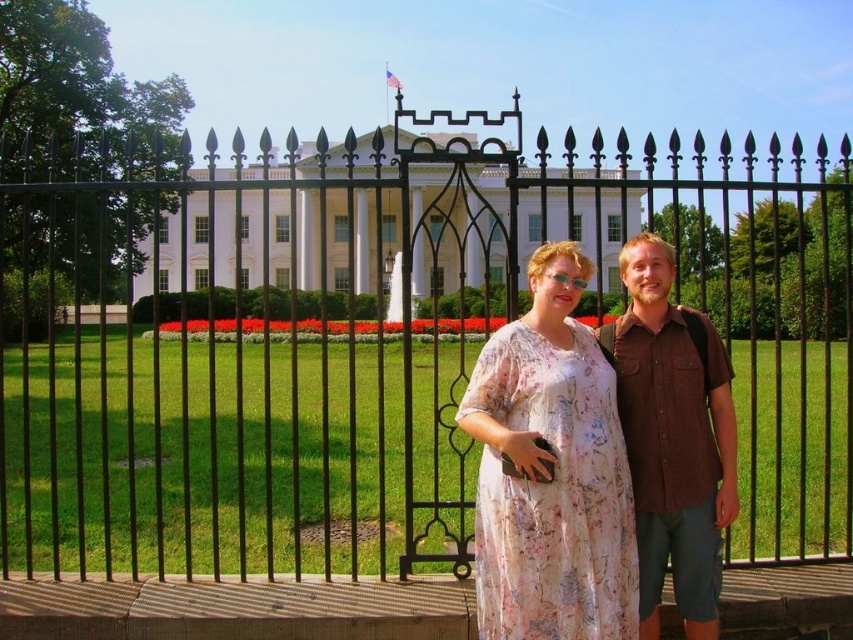
Question: Which object is positioned closest to the black wrought iron gate at center?

Choices:
 (A) brown cotton shirt at center
 (B) floral chiffon dress at center

Answer: (B)

Question: Does floral chiffon dress at center have a larger size compared to brown cotton shirt at center?

Choices:
 (A) no
 (B) yes

Answer: (A)

Question: Does black wrought iron gate at center come behind brown cotton shirt at center?

Choices:
 (A) yes
 (B) no

Answer: (B)

Question: In this image, where is black wrought iron gate at center located relative to brown cotton shirt at center?

Choices:
 (A) below
 (B) above

Answer: (B)

Question: Which point is farther from the camera taking this photo?

Choices:
 (A) (788, 324)
 (B) (511, 413)

Answer: (A)

Question: Based on their relative distances, which object is nearer to the black wrought iron gate at center?

Choices:
 (A) floral chiffon dress at center
 (B) brown cotton shirt at center

Answer: (A)